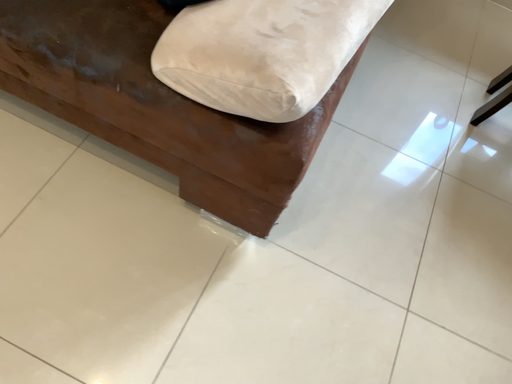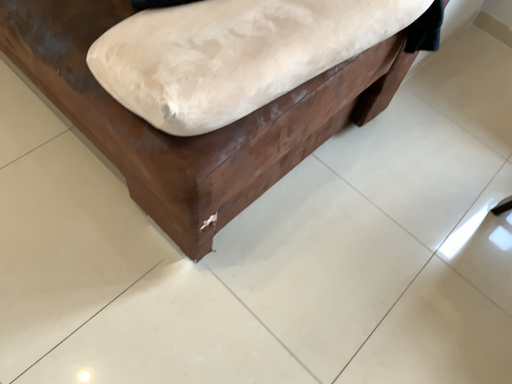
Question: How did the camera likely rotate when shooting the video?

Choices:
 (A) rotated right
 (B) rotated left

Answer: (B)